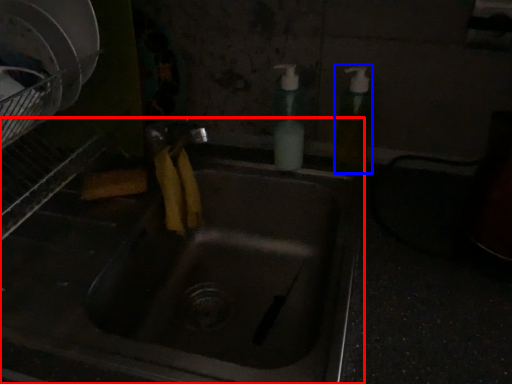
Question: Among these objects, which one is nearest to the camera, sink (highlighted by a red box) or soap dispenser (highlighted by a blue box)?

Choices:
 (A) sink
 (B) soap dispenser

Answer: (A)